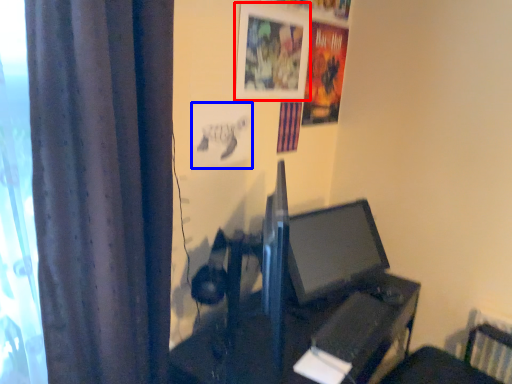
Question: Which of the following is the farthest to the observer, picture frame (highlighted by a red box) or poster page (highlighted by a blue box)?

Choices:
 (A) picture frame
 (B) poster page

Answer: (A)